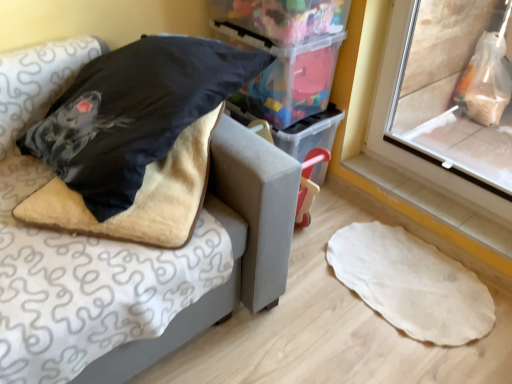
Question: Does transparent plastic window screen at right lie in front of velvet-like beige cushion at upper left?

Choices:
 (A) no
 (B) yes

Answer: (A)

Question: Does transparent plastic window screen at right have a lesser height compared to velvet-like beige cushion at upper left?

Choices:
 (A) yes
 (B) no

Answer: (B)

Question: From a real-world perspective, is transparent plastic window screen at right located higher than velvet-like beige cushion at upper left?

Choices:
 (A) yes
 (B) no

Answer: (A)

Question: Is transparent plastic window screen at right directly adjacent to velvet-like beige cushion at upper left?

Choices:
 (A) no
 (B) yes

Answer: (A)

Question: Would you say transparent plastic window screen at right contains velvet-like beige cushion at upper left?

Choices:
 (A) yes
 (B) no

Answer: (B)

Question: Is transparent plastic window screen at right taller or shorter than velvet black pillow at upper left?

Choices:
 (A) short
 (B) tall

Answer: (B)

Question: In the image, is transparent plastic window screen at right positioned in front of or behind velvet black pillow at upper left?

Choices:
 (A) behind
 (B) front

Answer: (A)

Question: Would you say transparent plastic window screen at right is to the left or to the right of velvet black pillow at upper left in the picture?

Choices:
 (A) left
 (B) right

Answer: (B)

Question: Looking at their shapes, would you say transparent plastic window screen at right is wider or thinner than velvet black pillow at upper left?

Choices:
 (A) wide
 (B) thin

Answer: (B)

Question: Considering the positions of translucent plastic storage box at upper center and white tile at lower right in the image, is translucent plastic storage box at upper center wider or thinner than white tile at lower right?

Choices:
 (A) wide
 (B) thin

Answer: (A)

Question: Based on their sizes in the image, would you say translucent plastic storage box at upper center is bigger or smaller than white tile at lower right?

Choices:
 (A) big
 (B) small

Answer: (A)

Question: Would you say translucent plastic storage box at upper center is to the left or to the right of white tile at lower right in the picture?

Choices:
 (A) right
 (B) left

Answer: (B)

Question: Is point (267, 44) closer or farther from the camera than point (490, 240)?

Choices:
 (A) farther
 (B) closer

Answer: (A)

Question: Considering the positions of point (244, 278) and point (408, 188), is point (244, 278) closer or farther from the camera than point (408, 188)?

Choices:
 (A) closer
 (B) farther

Answer: (A)

Question: Based on their positions, is velvet-like beige cushion at upper left located to the left or right of white tile at lower right?

Choices:
 (A) left
 (B) right

Answer: (A)